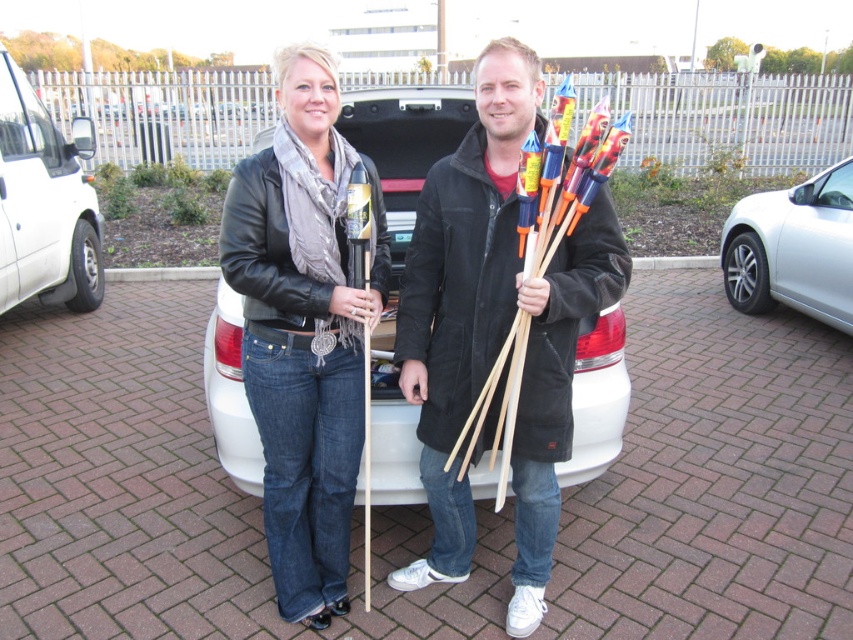
Is black suede coat at center taller than white matte car at center?

Correct, black suede coat at center is much taller as white matte car at center.

Consider the image. Between black suede coat at center and white matte car at center, which one appears on the right side from the viewer's perspective?

black suede coat at center

Between point (467, 563) and point (606, 420), which one is positioned behind?

Positioned behind is point (606, 420).

Locate an element on the screen. Image resolution: width=853 pixels, height=640 pixels. black suede coat at center is located at coordinates (495, 326).

From the picture: Which of these two, white matte car at center or white matte van at left, stands shorter?

white matte car at center

Between white matte car at center and white matte van at left, which one is positioned higher?

Positioned higher is white matte van at left.

Between point (428, 88) and point (24, 278), which one is positioned behind?

The point (24, 278) is behind.

Where is `white matte car at center`? The height and width of the screenshot is (640, 853). white matte car at center is located at coordinates pyautogui.click(x=403, y=157).

Is point (548, 403) positioned before point (831, 227)?

Yes, it is.

Does black suede coat at center appear under silver metallic car at right?

Correct, black suede coat at center is located below silver metallic car at right.

Identify the location of black suede coat at center. (495, 326).